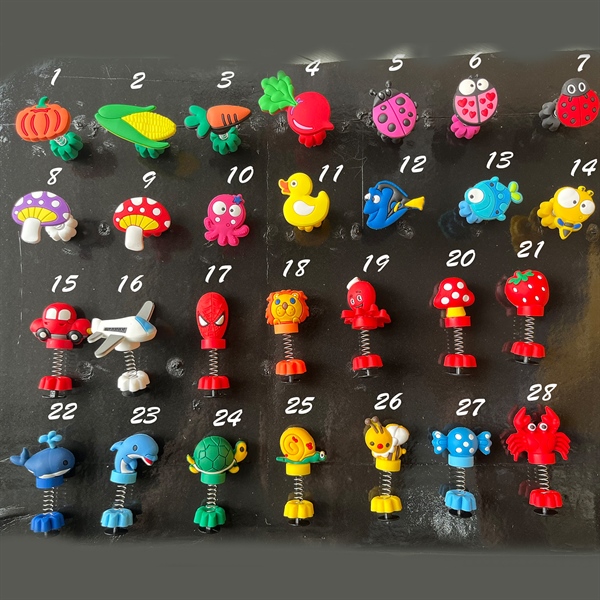
Identify the location of third row of toys. This screenshot has width=600, height=600. (60, 330), (114, 330), (208, 312), (278, 311), (362, 303), (447, 297), (530, 295).